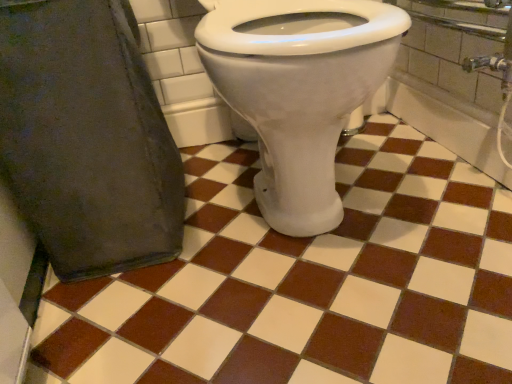
Describe the element at coordinates (306, 282) in the screenshot. I see `brown glossy tile at center` at that location.

I want to click on brown glossy tile at center, so click(306, 282).

Identify the location of brown glossy tile at center. This screenshot has width=512, height=384. (306, 282).